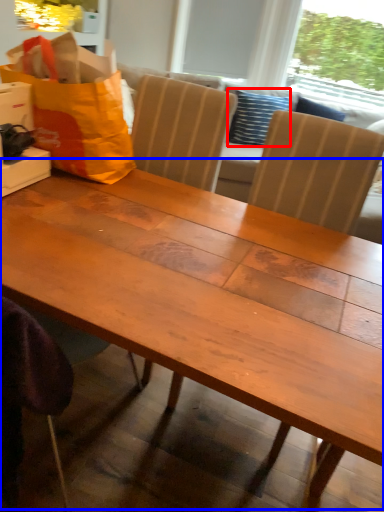
Question: Which object is closer to the camera taking this photo, pillow (highlighted by a red box) or table (highlighted by a blue box)?

Choices:
 (A) pillow
 (B) table

Answer: (B)